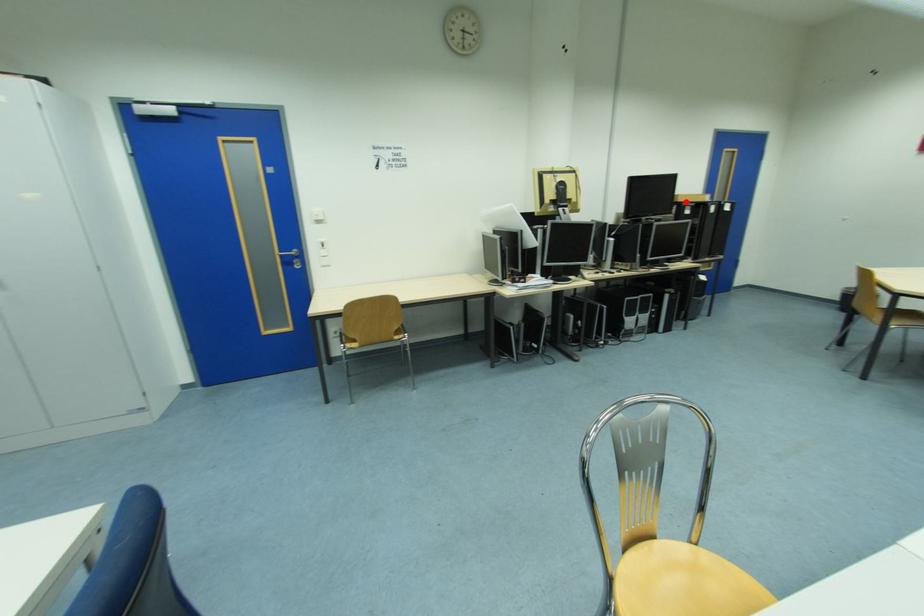
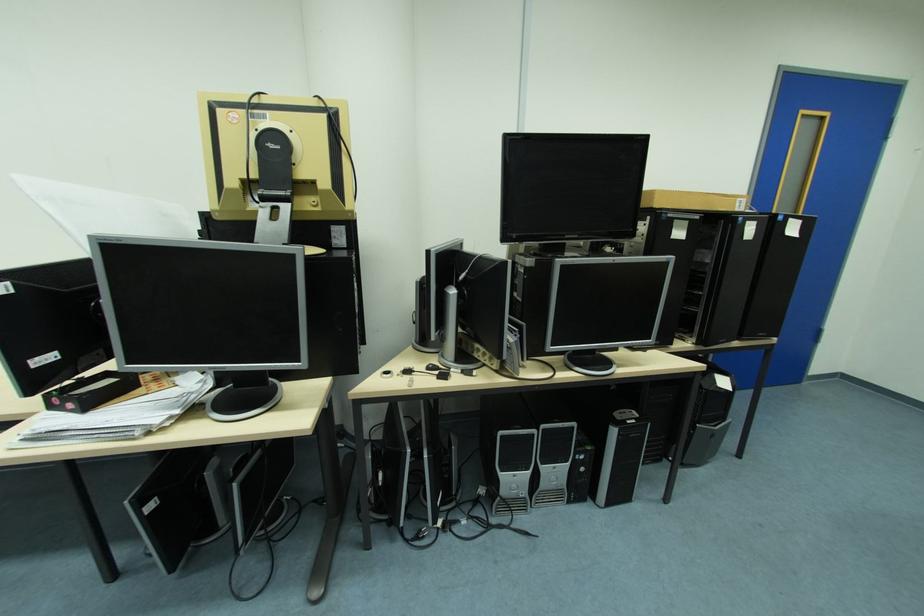
The point at the highlighted location is marked in the first image. Where is the corresponding point in the second image?

(664, 206)